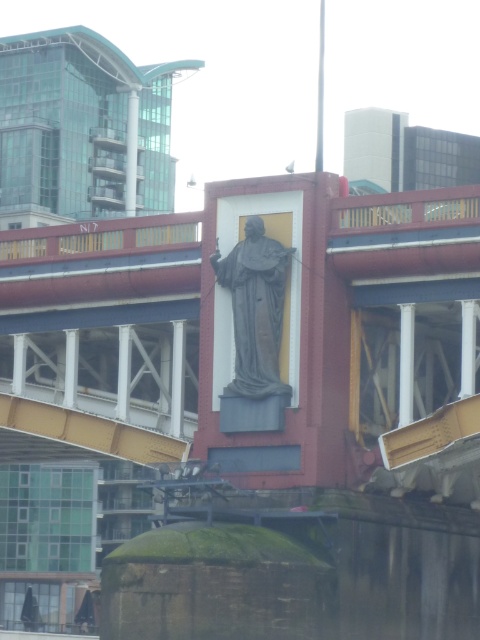
Question: Where is concrete bridge at center located in relation to gray stone statue at center in the image?

Choices:
 (A) above
 (B) below

Answer: (B)

Question: Which point is closer to the camera?

Choices:
 (A) concrete bridge at center
 (B) gray stone statue at center

Answer: (A)

Question: Can you confirm if concrete bridge at center is smaller than gray stone statue at center?

Choices:
 (A) no
 (B) yes

Answer: (A)

Question: Considering the relative positions of concrete bridge at center and gray stone statue at center in the image provided, where is concrete bridge at center located with respect to gray stone statue at center?

Choices:
 (A) left
 (B) right

Answer: (A)

Question: Which object is closer to the camera taking this photo?

Choices:
 (A) concrete bridge at center
 (B) gray stone statue at center

Answer: (A)